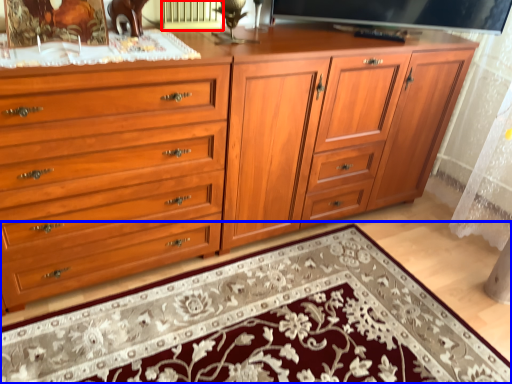
Question: Which object appears closest to the camera in this image, radiator (highlighted by a red box) or mat (highlighted by a blue box)?

Choices:
 (A) radiator
 (B) mat

Answer: (B)